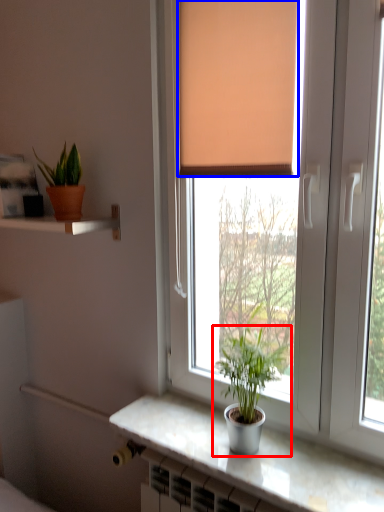
Question: Which of the following is the closest to the observer, houseplant (highlighted by a red box) or curtain (highlighted by a blue box)?

Choices:
 (A) houseplant
 (B) curtain

Answer: (A)